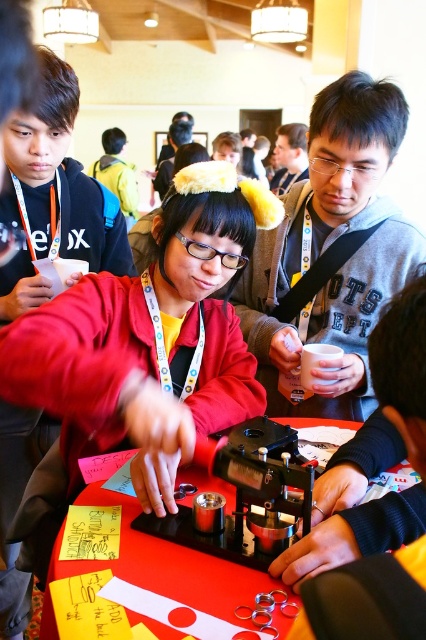
Is matte gray hoodie at center taller than red plastic table at center?

Yes, matte gray hoodie at center is taller than red plastic table at center.

The height and width of the screenshot is (640, 426). In order to click on matte gray hoodie at center in this screenshot , I will do `click(331, 253)`.